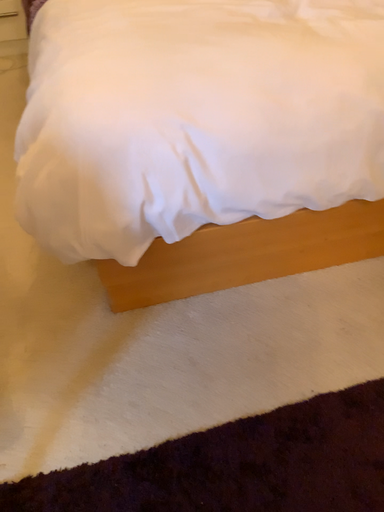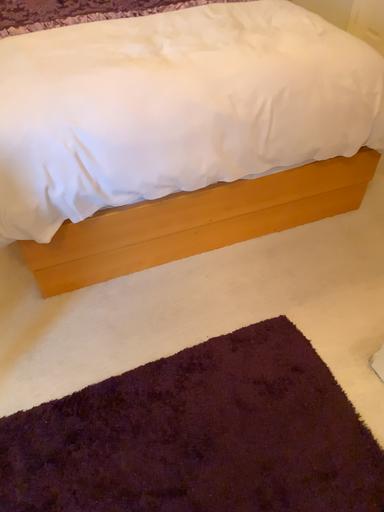
Question: Which way did the camera rotate in the video?

Choices:
 (A) rotated downward
 (B) rotated upward

Answer: (B)